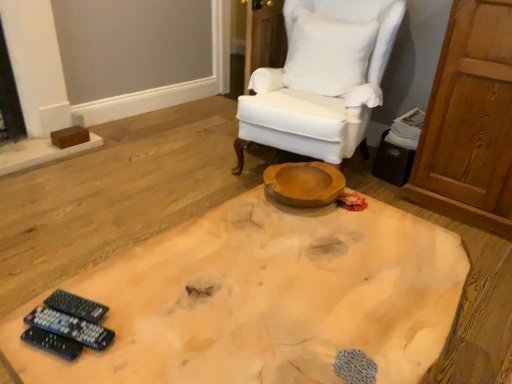
Image resolution: width=512 pixels, height=384 pixels. Find the location of `free point behind black plastic remote controls at lower left, the 1th remote control viewed from the back`. free point behind black plastic remote controls at lower left, the 1th remote control viewed from the back is located at coordinates (115, 269).